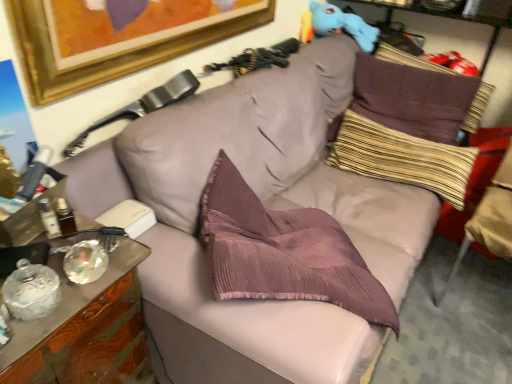
Question: Can you confirm if wooden cabinet at left is bigger than beige fabric swivel chair at right, placed as the second swivel chair when sorted from left to right?

Choices:
 (A) yes
 (B) no

Answer: (B)

Question: Is wooden cabinet at left closer to the viewer compared to beige fabric swivel chair at right, the 1th swivel chair positioned from the right?

Choices:
 (A) yes
 (B) no

Answer: (A)

Question: From a real-world perspective, is wooden cabinet at left physically below beige fabric swivel chair at right, the 1th swivel chair positioned from the right?

Choices:
 (A) no
 (B) yes

Answer: (B)

Question: From the image's perspective, is wooden cabinet at left on top of beige fabric swivel chair at right, the 1th swivel chair positioned from the right?

Choices:
 (A) no
 (B) yes

Answer: (A)

Question: Can you see wooden cabinet at left touching beige fabric swivel chair at right, placed as the second swivel chair when sorted from left to right?

Choices:
 (A) yes
 (B) no

Answer: (B)

Question: Is beige fabric swivel chair at right, placed as the second swivel chair when sorted from left to right, taller or shorter than striped fabric pillow at upper right, the second pillow viewed from the top?

Choices:
 (A) short
 (B) tall

Answer: (B)

Question: In terms of width, does beige fabric swivel chair at right, placed as the second swivel chair when sorted from left to right, look wider or thinner when compared to striped fabric pillow at upper right, the second pillow viewed from the top?

Choices:
 (A) wide
 (B) thin

Answer: (A)

Question: Considering the positions of beige fabric swivel chair at right, the 1th swivel chair positioned from the right, and striped fabric pillow at upper right, the second pillow viewed from the top, in the image, is beige fabric swivel chair at right, the 1th swivel chair positioned from the right, bigger or smaller than striped fabric pillow at upper right, the second pillow viewed from the top,?

Choices:
 (A) small
 (B) big

Answer: (B)

Question: Is point (470, 220) positioned closer to the camera than point (448, 201)?

Choices:
 (A) farther
 (B) closer

Answer: (B)

Question: In the image, is leather at upper left, positioned as the 2th swivel chair in right-to-left order, positioned in front of or behind striped fabric pillow at upper right, the second pillow viewed from the top?

Choices:
 (A) behind
 (B) front

Answer: (B)

Question: Is leather at upper left, acting as the first swivel chair starting from the left, situated inside striped fabric pillow at upper right, which is counted as the 1th pillow, starting from the bottom, or outside?

Choices:
 (A) outside
 (B) inside

Answer: (A)

Question: Considering the positions of leather at upper left, acting as the first swivel chair starting from the left, and striped fabric pillow at upper right, which is counted as the 1th pillow, starting from the bottom, in the image, is leather at upper left, acting as the first swivel chair starting from the left, taller or shorter than striped fabric pillow at upper right, which is counted as the 1th pillow, starting from the bottom,?

Choices:
 (A) short
 (B) tall

Answer: (A)

Question: Is leather at upper left, positioned as the 2th swivel chair in right-to-left order, wider or thinner than striped fabric pillow at upper right, which is counted as the 1th pillow, starting from the bottom?

Choices:
 (A) thin
 (B) wide

Answer: (A)

Question: In terms of height, does beige fabric swivel chair at right, placed as the second swivel chair when sorted from left to right, look taller or shorter compared to wooden cabinet at left?

Choices:
 (A) short
 (B) tall

Answer: (B)

Question: Looking at the image, does beige fabric swivel chair at right, placed as the second swivel chair when sorted from left to right, seem bigger or smaller compared to wooden cabinet at left?

Choices:
 (A) big
 (B) small

Answer: (A)